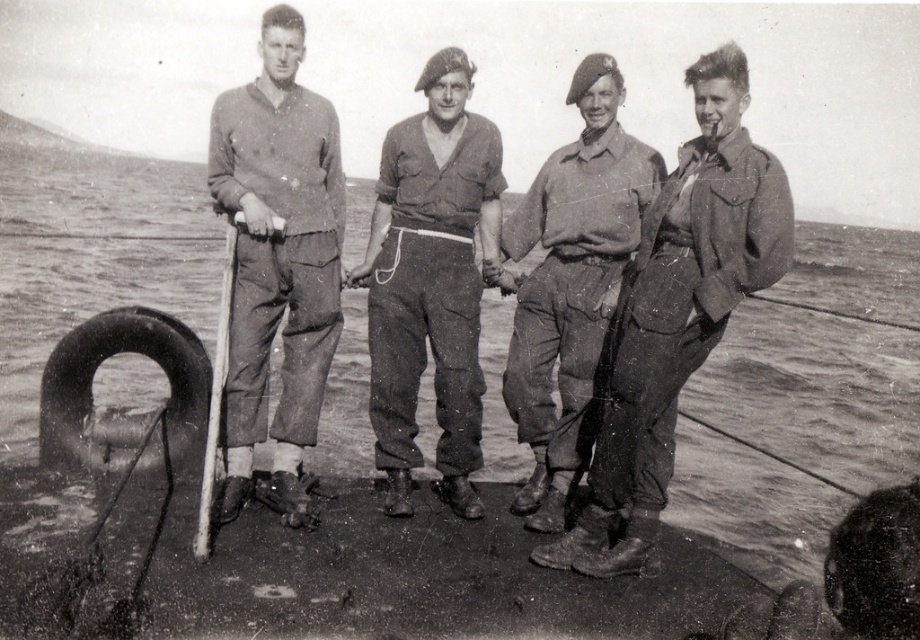
You are a photographer analyzing this historical image. You notice the matte khaki pants at center and the black rubber tire at lower left. Based on the scene, which object appears bigger in the photo?

The matte khaki pants at center appears bigger than the black rubber tire at lower left in the photo.

You are a photographer analyzing this black and white image. You notice two items of clothing labeled as the matte khaki jacket at right and the matte khaki pants at center. Based on their positions in the scene, which one appears nearer to you?

The matte khaki jacket at right is closer to the viewer than the matte khaki pants at center, so the jacket appears nearer.

You are a photographer analyzing this historical image. You notice the matte khaki jacket at right and the black rubber tire at lower left. Which object is positioned in front of the other?

The matte khaki jacket at right is closer to the viewer than the black rubber tire at lower left, so it is positioned in front of the black rubber tire at lower left.